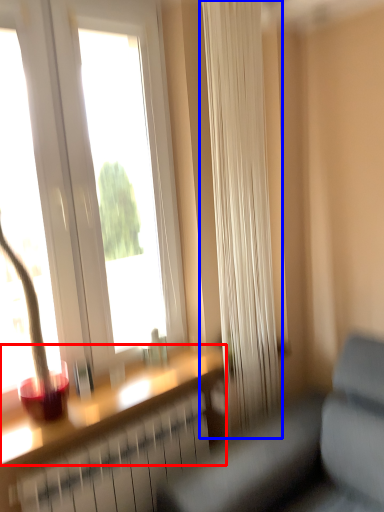
Question: Which of the following is the closest to the observer, window sill (highlighted by a red box) or curtain (highlighted by a blue box)?

Choices:
 (A) window sill
 (B) curtain

Answer: (A)